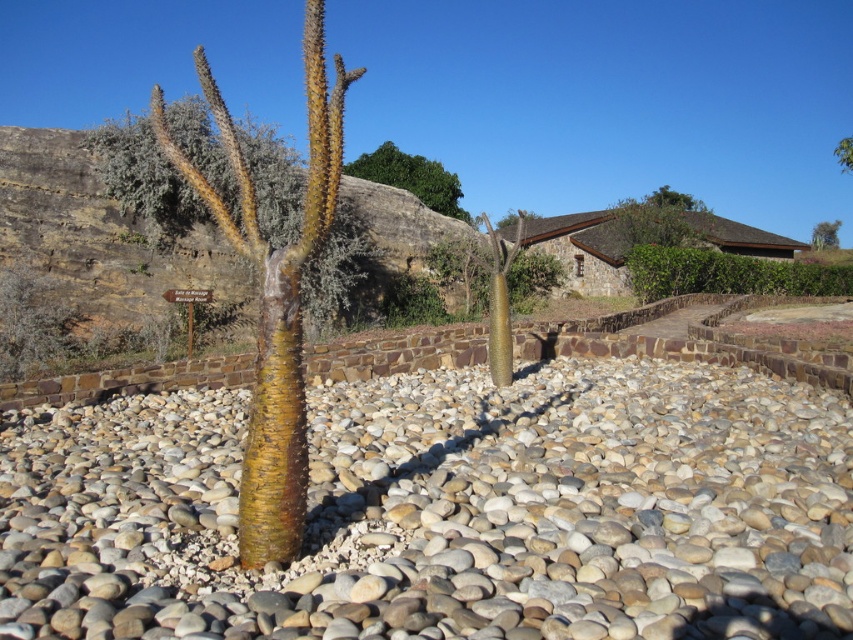
You are planning to place a decorative stone that is 15 cm wide on the ground. The smooth pebbles at center and the brown textured cactus at center are already present. Can the decorative stone fit between the two objects without overlapping them?

The smooth pebbles at center are narrower than the brown textured cactus at center. Since the decorative stone is 15 cm wide, it depends on the available space between them. However, the exact distance isn

You are a gardener planning to plant a new flower bed between the smooth pebbles at center and the brown textured cactus at center. Considering their heights, which object should you place the flower bed closer to to ensure the flowers are visible from above?

The flower bed should be placed closer to the smooth pebbles at center since they are shorter than the brown textured cactus at center, allowing the flowers to be more visible from above.